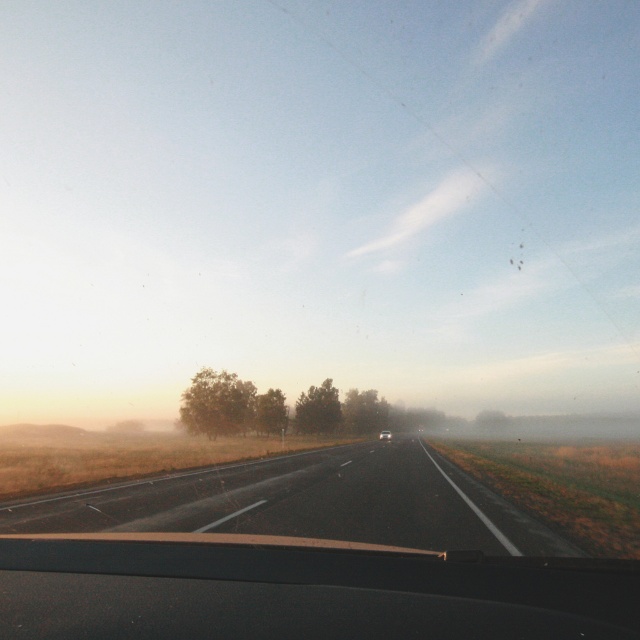
In the scene shown: You are driving a matte black car at center and want to see the road ahead. Can you see the black asphalt highway at center through your windshield?

The black asphalt highway at center is in front of the matte black car at center, so yes, you can see the black asphalt highway at center through your windshield because it is directly ahead of the car.

You are driving a matte black car at center and want to stay in your lane on the black asphalt highway at center. Which side should you position yourself relative to the highway?

You should position yourself to the right of the black asphalt highway at center since the highway is to the left of the matte black car at center.